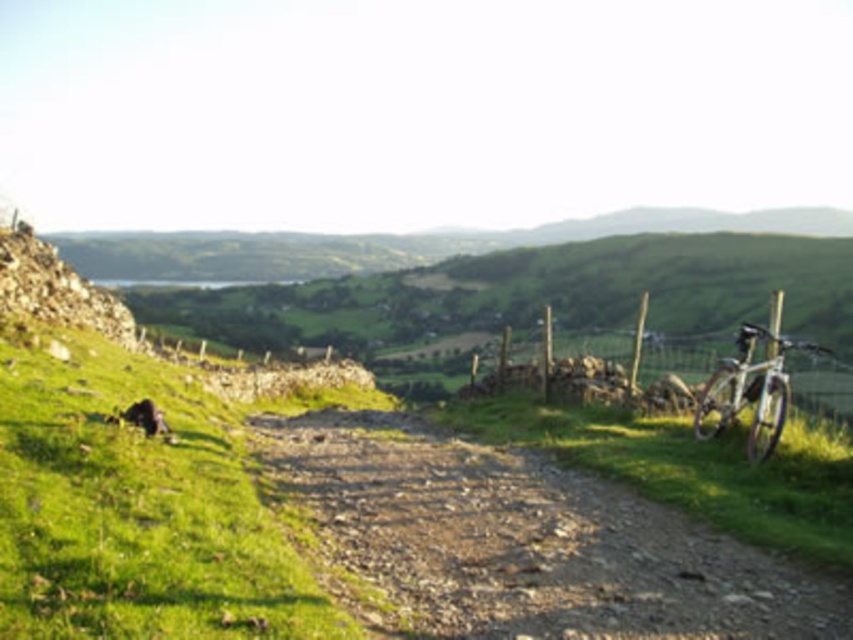
You are a hiker who wants to take both the silver metallic mountain bike at right and the fuzzy brown dog at lower left with you on a trail. However, you can only carry one item at a time. Based on their sizes, which item should you choose to carry first to ensure it fits in your backpack?

The silver metallic mountain bike at right is larger than the fuzzy brown dog at lower left, so you should carry the fuzzy brown dog at lower left first since it is smaller and more likely to fit in your backpack.

You are a hiker planning to walk along the dirt path bordered by the wooden fence and the stone wall. You notice the wooden post at right and the silver metallic mountain bike at right. How far apart are these two items from each other?

The wooden post at right and the silver metallic mountain bike at right are 3.33 meters apart from each other.